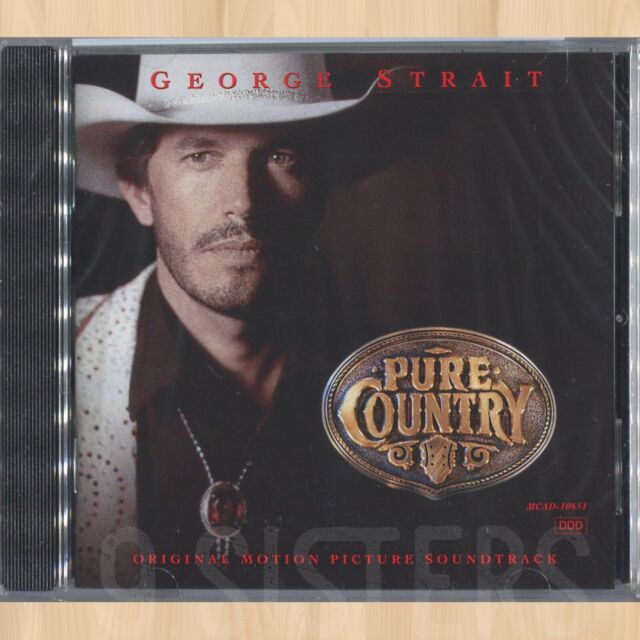
This screenshot has height=640, width=640. I want to click on picture, so click(386, 559).